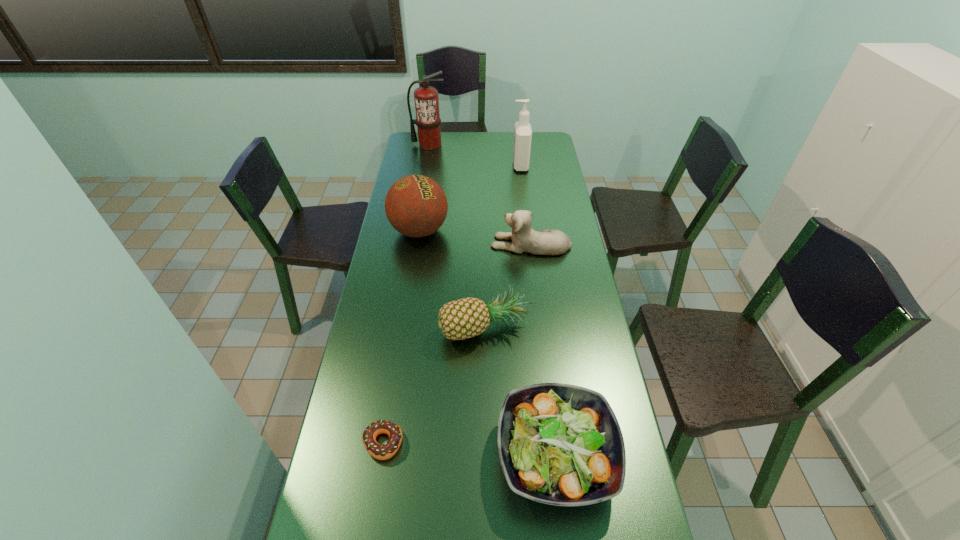
Where is `object that is the sixth closest to the third nearest object`? The image size is (960, 540). object that is the sixth closest to the third nearest object is located at coordinates point(428,121).

Find the location of a particular element. This screenshot has height=540, width=960. vacant point that satisfies the following two spatial constraints: 1. on the front side of the second shortest object; 2. on the right side of the shortest object is located at coordinates (381, 455).

Identify the location of free space that satisfies the following two spatial constraints: 1. on the front label of the second farthest object; 2. on the front side of the third nearest object. point(540,326).

The image size is (960, 540). Find the location of `vacant space that satisfies the following two spatial constraints: 1. on the front-facing side of the puppy; 2. on the front side of the second shortest object`. vacant space that satisfies the following two spatial constraints: 1. on the front-facing side of the puppy; 2. on the front side of the second shortest object is located at coordinates (557, 455).

This screenshot has height=540, width=960. I want to click on free space that satisfies the following two spatial constraints: 1. on the front side of the salad plate; 2. on the left side of the pineapple, so click(x=486, y=455).